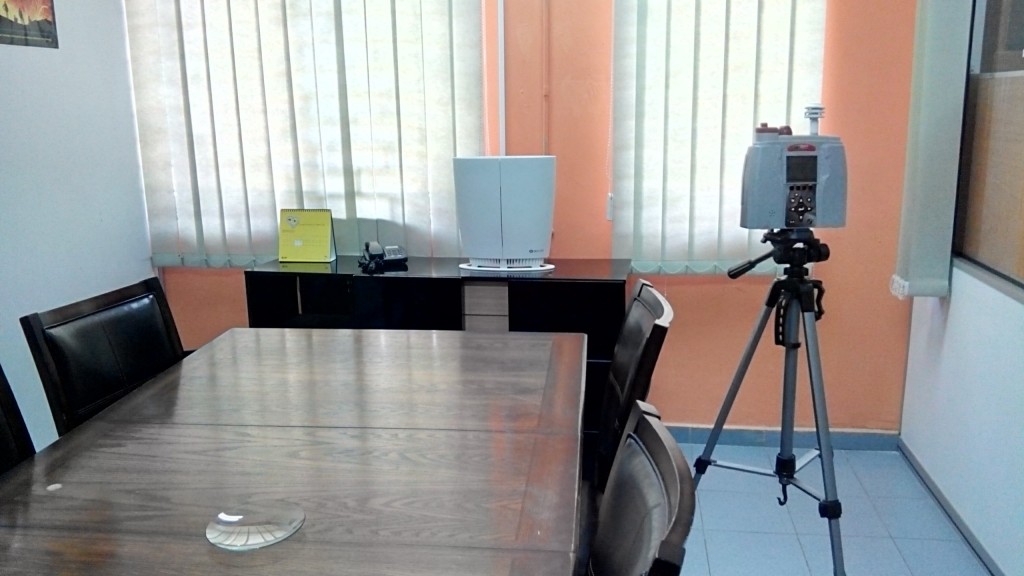
Locate an element on the screen. Image resolution: width=1024 pixels, height=576 pixels. conference room window is located at coordinates (1008, 41), (692, 77), (326, 84).